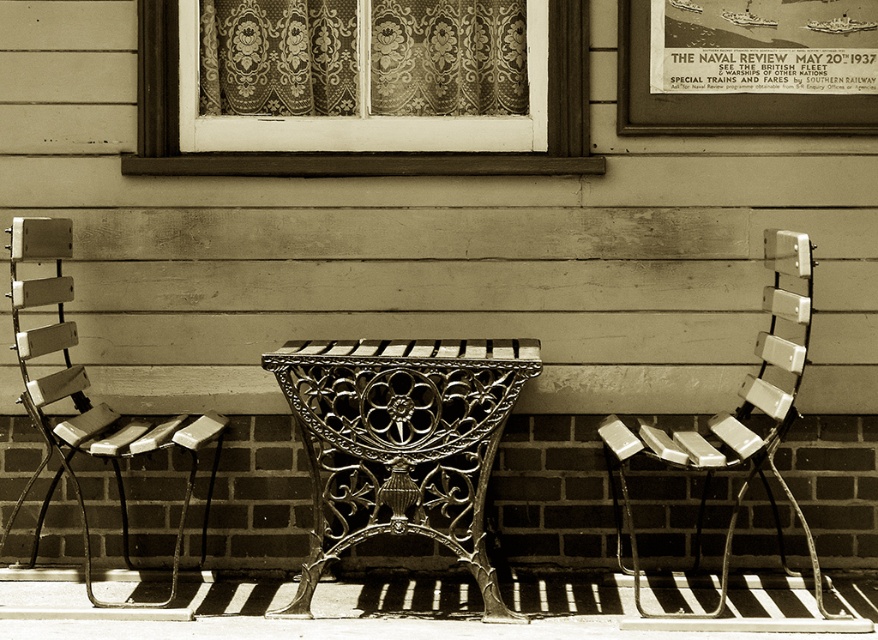
Question: Does matte lace curtain at upper center appear under metallic silver chair at right?

Choices:
 (A) yes
 (B) no

Answer: (B)

Question: Is the position of cast iron bench at center more distant than that of metallic poster at upper right?

Choices:
 (A) no
 (B) yes

Answer: (A)

Question: Can you confirm if matte wood chair at left is thinner than metallic silver chair at right?

Choices:
 (A) no
 (B) yes

Answer: (A)

Question: Which object is farther from the camera taking this photo?

Choices:
 (A) matte wood chair at left
 (B) matte lace curtain at upper center
 (C) metallic poster at upper right
 (D) cast iron bench at center

Answer: (B)

Question: Which point is farther to the camera?

Choices:
 (A) (371, 170)
 (B) (49, 289)
 (C) (797, 272)

Answer: (A)

Question: Estimate the real-world distances between objects in this image. Which object is farther from the metallic silver chair at right?

Choices:
 (A) matte lace curtain at upper center
 (B) matte wood chair at left
 (C) metallic poster at upper right
 (D) cast iron bench at center

Answer: (B)